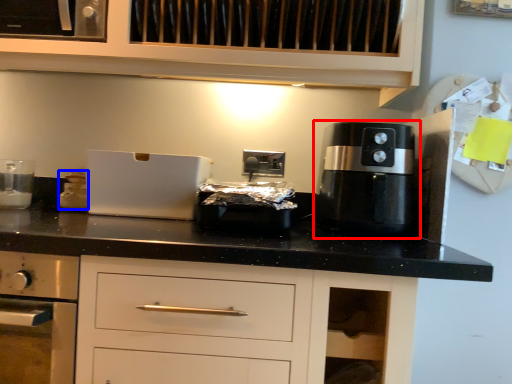
Question: Which object is further to the camera taking this photo, coffee machine (highlighted by a red box) or kitchen appliance (highlighted by a blue box)?

Choices:
 (A) coffee machine
 (B) kitchen appliance

Answer: (B)